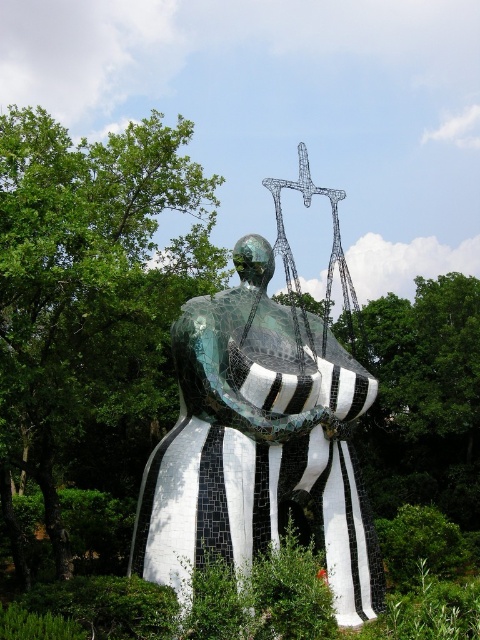
Does green leafy tree at left have a larger size compared to black and white mosaic statue at center?

Yes.

Describe the element at coordinates (93, 300) in the screenshot. I see `green leafy tree at left` at that location.

Between point (20, 566) and point (252, 380), which one is positioned behind?

The point (20, 566) is more distant.

Identify the location of green leafy tree at left. This screenshot has height=640, width=480. (93, 300).

Who is more forward, (305, 440) or (342, 196)?

Point (305, 440)

Who is taller, black and white mosaic statue at center or metallic wire sculpture at upper center?

Standing taller between the two is black and white mosaic statue at center.

The width and height of the screenshot is (480, 640). Identify the location of black and white mosaic statue at center. (259, 442).

Is green leafy tree at left taller than metallic wire sculpture at upper center?

Indeed, green leafy tree at left has a greater height compared to metallic wire sculpture at upper center.

Can you confirm if green leafy tree at left is positioned to the right of metallic wire sculpture at upper center?

Incorrect, green leafy tree at left is not on the right side of metallic wire sculpture at upper center.

Between point (33, 236) and point (355, 355), which one is positioned in front?

Positioned in front is point (33, 236).

Identify the location of green leafy tree at left. The width and height of the screenshot is (480, 640). (93, 300).